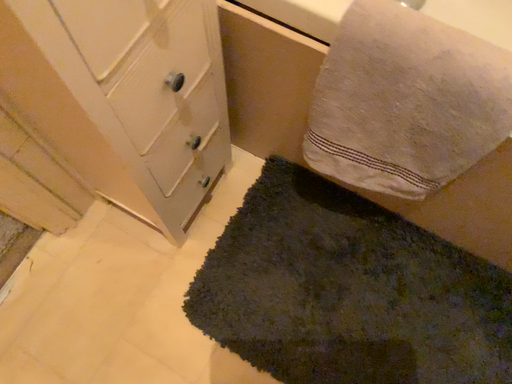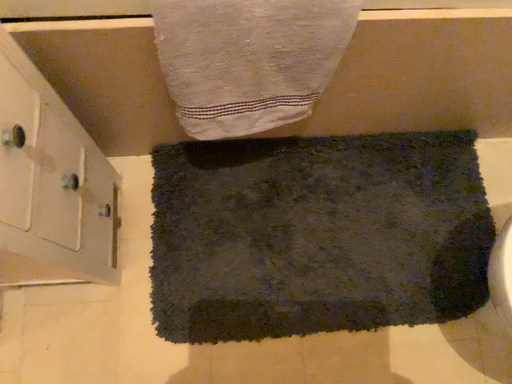
Question: Which way did the camera rotate in the video?

Choices:
 (A) rotated left
 (B) rotated right

Answer: (B)